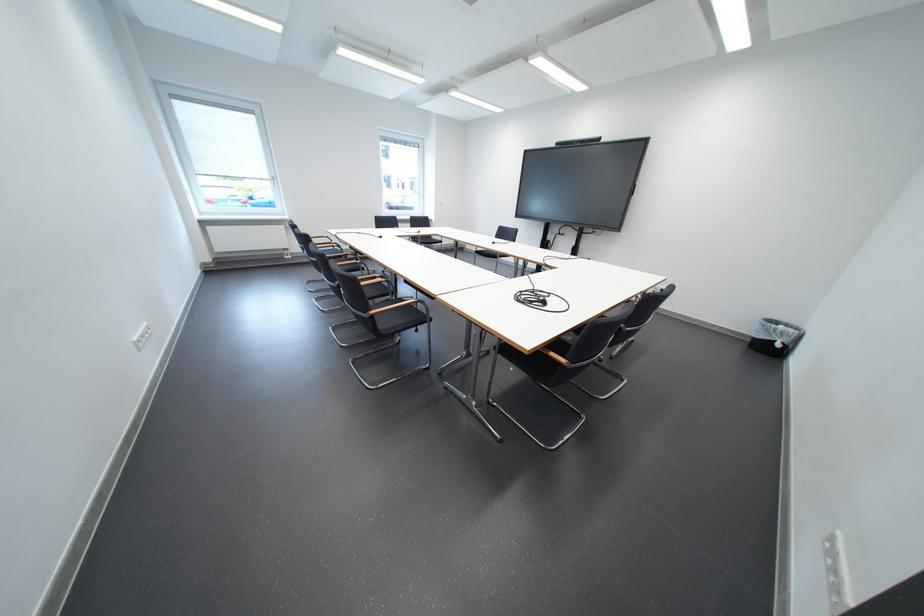
The height and width of the screenshot is (616, 924). What are the coordinates of `wall power outlet` in the screenshot? It's located at [140, 336].